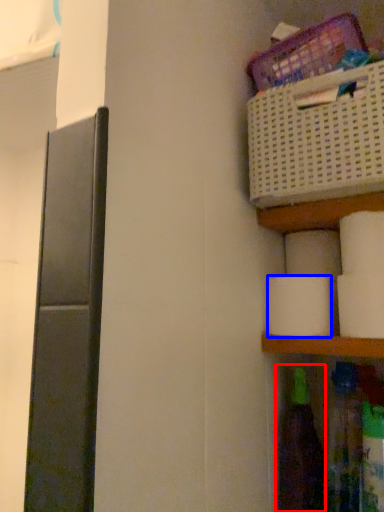
Question: Among these objects, which one is farthest to the camera, bottle (highlighted by a red box) or toilet paper (highlighted by a blue box)?

Choices:
 (A) bottle
 (B) toilet paper

Answer: (A)